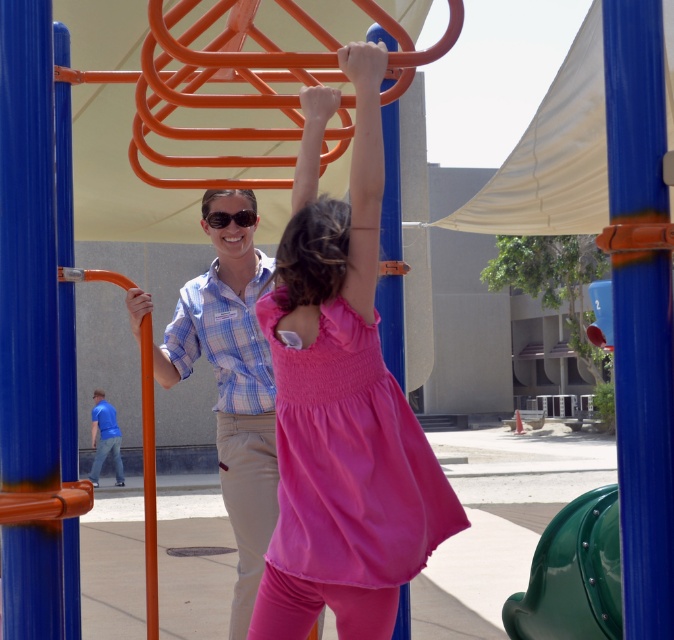
You are standing at the playground and want to place a small bench between the two points, point (611, 96) and point (222, 218). Which point should the bench be closer to if you want it to be near the young girl climbing the orange monkey bars?

The bench should be placed closer to point (611, 96) because it is closer to the viewer, where the young girl is actively climbing the orange monkey bars.